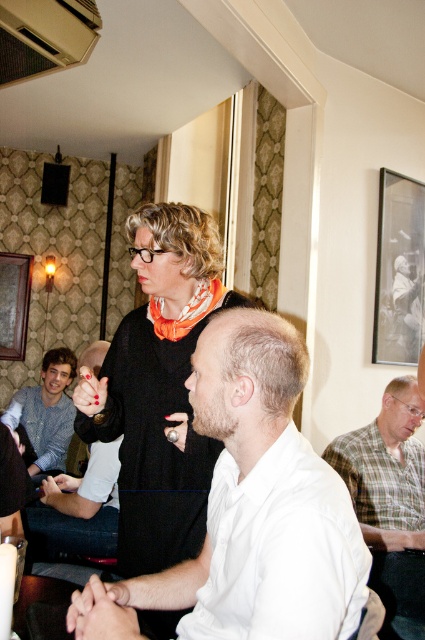
I want to click on black matte picture frame at upper right, so click(x=399, y=269).

Who is lower down, black matte picture frame at upper right or knitted sweater at left?

knitted sweater at left

Is point (402, 301) positioned in front of point (39, 444)?

Yes, point (402, 301) is closer to viewer.

Find the location of a particular element. Image resolution: width=425 pixels, height=640 pixels. black matte picture frame at upper right is located at coordinates (399, 269).

The image size is (425, 640). Describe the element at coordinates (78, 509) in the screenshot. I see `white shirt at center` at that location.

Does white shirt at center appear over wooden picture frame at left?

No, white shirt at center is not above wooden picture frame at left.

What do you see at coordinates (78, 509) in the screenshot?
I see `white shirt at center` at bounding box center [78, 509].

The height and width of the screenshot is (640, 425). I want to click on white shirt at center, so coord(78,509).

Who is more distant from viewer, (422, 237) or (37, 516)?

→ Positioned behind is point (422, 237).

Does black matte picture frame at upper right have a greater width compared to white shirt at center?

No.

Identify the location of black matte picture frame at upper right. [399, 269].

Where is `black matte picture frame at upper right`? black matte picture frame at upper right is located at coordinates (399, 269).